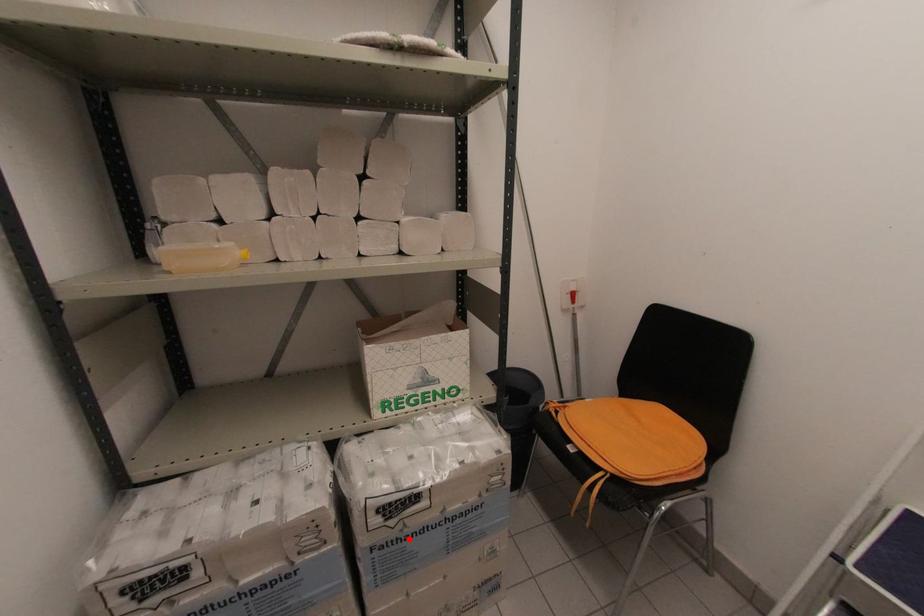
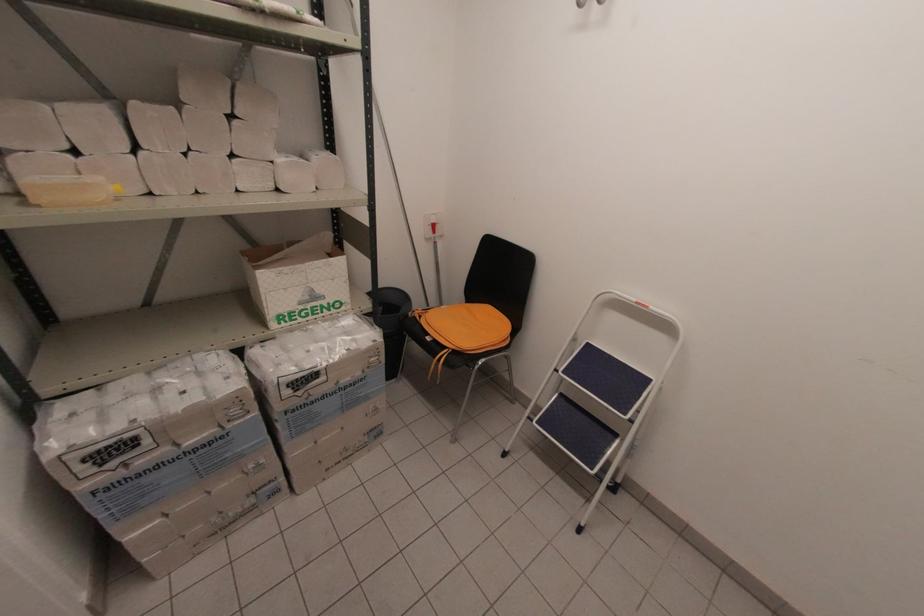
Where in the second image is the point corresponding to the highlighted location from the first image?

(312, 403)